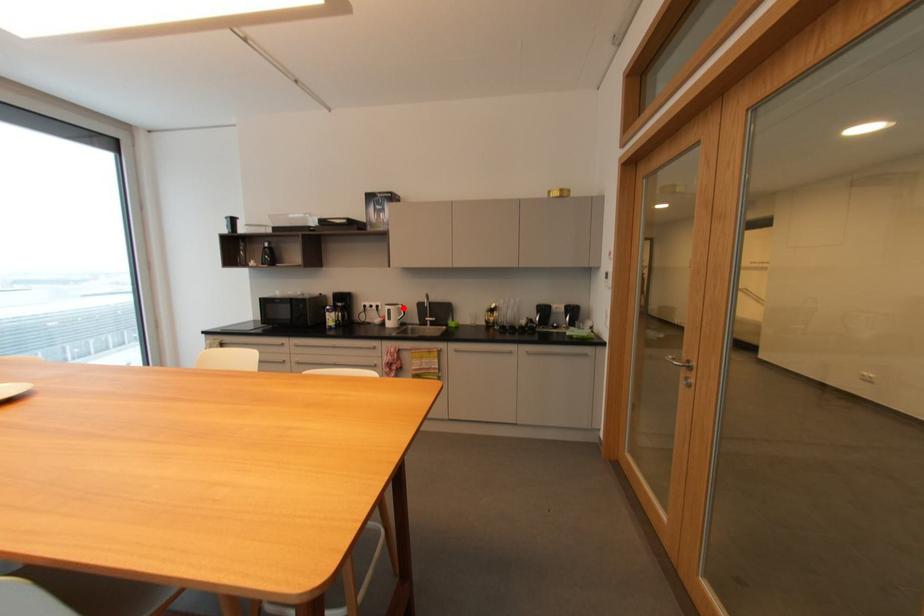
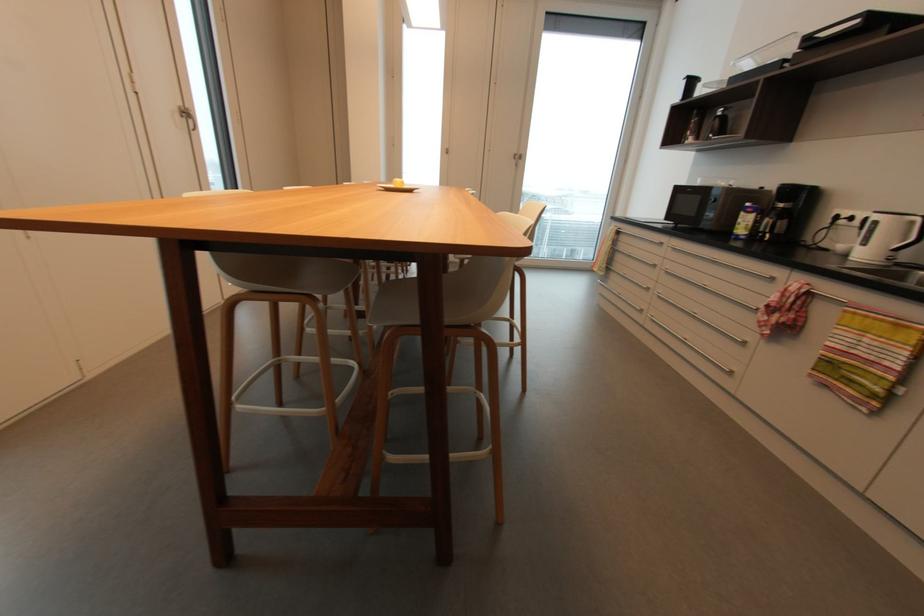
Locate, in the second image, the point that corresponds to the highlighted location in the first image.

(916, 223)